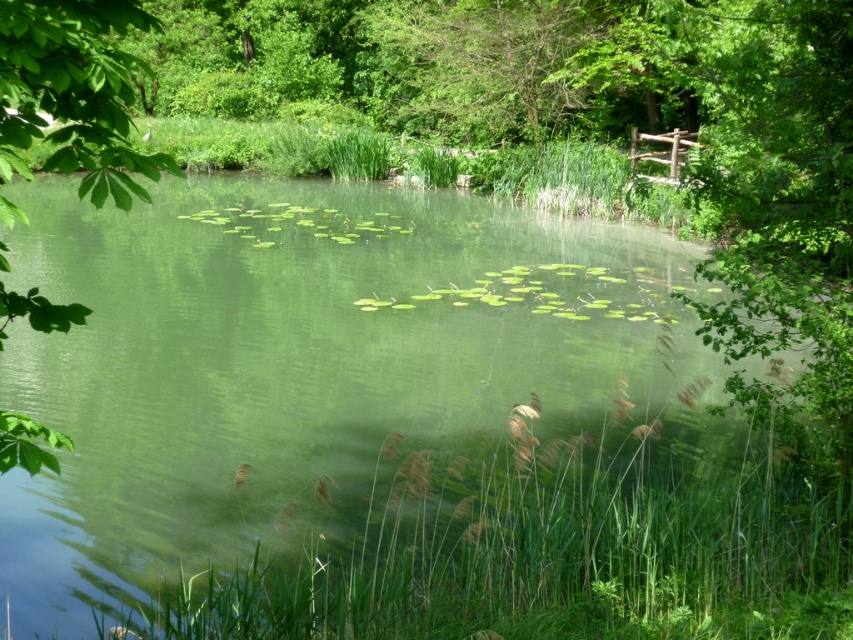
You are standing at the edge of the water and want to place a small floating decoration exactly at the center of the green translucent water at center. According to the coordinates provided, what are the coordinates where you should place the decoration?

The coordinates for placing the small floating decoration at the center of the green translucent water at center are at point [389,428].

You are a small boat operator who needs to navigate between the green translucent water at center and the green leafy tree at left. Given that your boat requires a minimum of 20 feet of clearance to safely pass through, can you safely navigate between them?

The distance between the green translucent water at center and the green leafy tree at left is 22.17 feet, which is more than the required 20 feet clearance. Therefore, you can safely navigate between them.